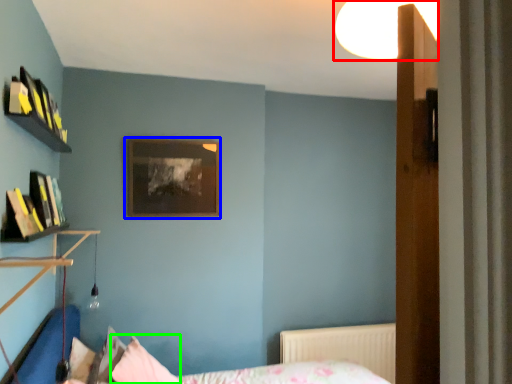
Question: Based on their relative distances, which object is farther from light fixture (highlighted by a red box)? Choose from picture frame (highlighted by a blue box) and pillow (highlighted by a green box).

Choices:
 (A) picture frame
 (B) pillow

Answer: (B)